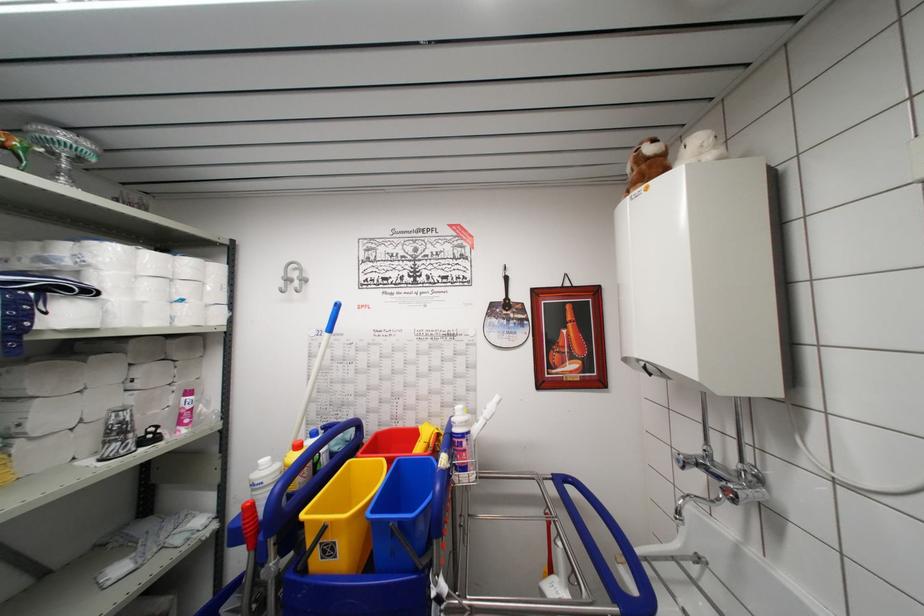
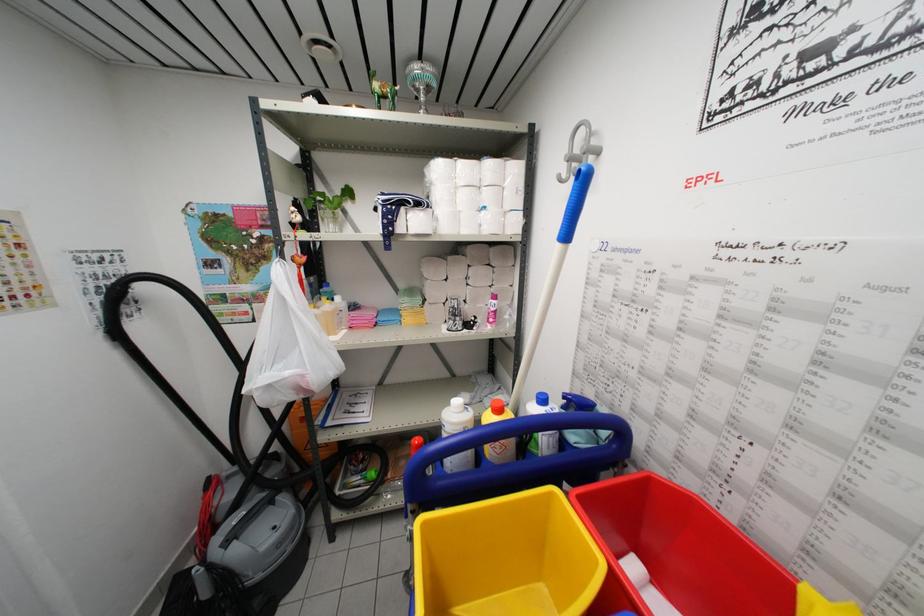
Based on the continuous images, in which direction is the camera rotating?

The camera rotated toward left-down.